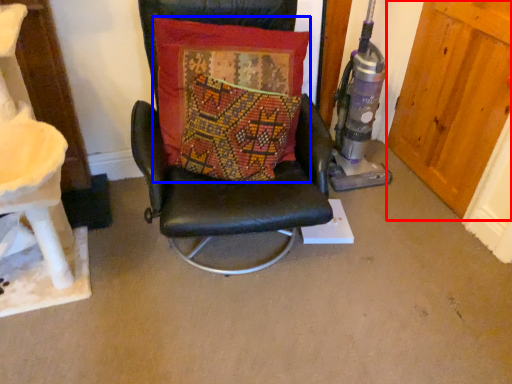
Question: Which object is closer to the camera taking this photo, door (highlighted by a red box) or pillow (highlighted by a blue box)?

Choices:
 (A) door
 (B) pillow

Answer: (B)